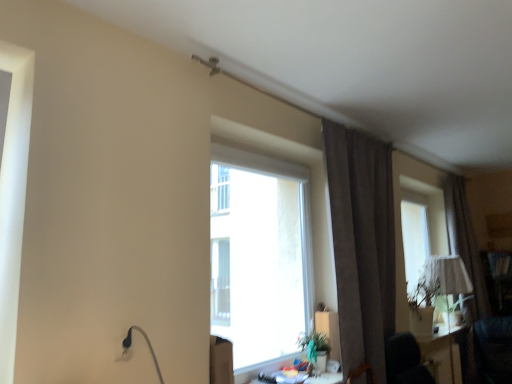
Question: From the image's perspective, is matte white table at lower right, which appears as the second table when viewed from the left, beneath brown fabric curtain at right, which is counted as the 2th curtain, starting from the front?

Choices:
 (A) no
 (B) yes

Answer: (B)

Question: Is matte white table at lower right, which appears as the second table when viewed from the left, located outside brown fabric curtain at right, which is counted as the second curtain, starting from the left?

Choices:
 (A) yes
 (B) no

Answer: (A)

Question: Can you confirm if matte white table at lower right, placed as the first table when sorted from bottom to top, is smaller than brown fabric curtain at right, the first curtain when ordered from back to front?

Choices:
 (A) no
 (B) yes

Answer: (B)

Question: Is matte white table at lower right, arranged as the first table when viewed from the back, far away from brown fabric curtain at right, which is counted as the second curtain, starting from the left?

Choices:
 (A) yes
 (B) no

Answer: (A)

Question: Is matte white table at lower right, placed as the first table when sorted from bottom to top, oriented away from brown fabric curtain at right, the first curtain when ordered from back to front?

Choices:
 (A) yes
 (B) no

Answer: (B)

Question: Is the position of matte white table at lower right, the second table viewed from the top, less distant than that of brown fabric curtain at right, which is counted as the 2th curtain, starting from the front?

Choices:
 (A) no
 (B) yes

Answer: (B)

Question: Is brown fabric curtain at right, the first curtain when ordered from back to front, surrounded by matte white lampshade at right?

Choices:
 (A) yes
 (B) no

Answer: (B)

Question: From a real-world perspective, is matte white lampshade at right located higher than brown fabric curtain at right, the 1th curtain viewed from the right?

Choices:
 (A) no
 (B) yes

Answer: (A)

Question: Considering the relative positions of matte white lampshade at right and brown fabric curtain at right, the first curtain when ordered from back to front, in the image provided, is matte white lampshade at right to the right of brown fabric curtain at right, the first curtain when ordered from back to front, from the viewer's perspective?

Choices:
 (A) no
 (B) yes

Answer: (A)

Question: Does matte white lampshade at right come in front of brown fabric curtain at right, the 1th curtain viewed from the right?

Choices:
 (A) yes
 (B) no

Answer: (B)

Question: Does matte white lampshade at right have a smaller size compared to brown fabric curtain at right, which is counted as the second curtain, starting from the left?

Choices:
 (A) no
 (B) yes

Answer: (B)

Question: Is matte white lampshade at right further to the viewer compared to brown fabric curtain at right, the 1th curtain viewed from the right?

Choices:
 (A) no
 (B) yes

Answer: (B)

Question: Is brown fabric curtain at right, which is counted as the second curtain, starting from the left, facing away from transparent glass window at center?

Choices:
 (A) no
 (B) yes

Answer: (A)